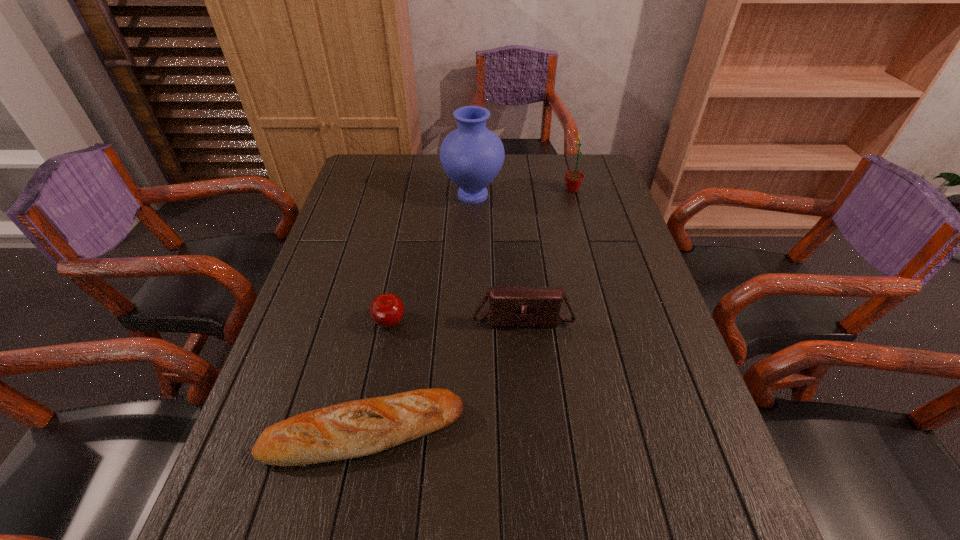
The width and height of the screenshot is (960, 540). In order to click on free space located on the face of the sunflower in this screenshot , I will do `click(469, 190)`.

I want to click on vacant space positioned 0.060m on the front flap of the shoulder bag, so point(526,352).

The image size is (960, 540). Find the location of `free location located 0.210m on the back of the cherry`. free location located 0.210m on the back of the cherry is located at coordinates (402, 255).

Locate an element on the screen. This screenshot has width=960, height=540. vacant region located on the back of the nearest object is located at coordinates (379, 362).

Find the location of a particular element. This screenshot has height=540, width=960. vase that is at the far edge is located at coordinates click(x=472, y=156).

The image size is (960, 540). What are the coordinates of `sunflower positioned at the far edge` in the screenshot? It's located at (573, 179).

Find the location of a particular element. The width and height of the screenshot is (960, 540). object at the left edge is located at coordinates (352, 429).

Identify the location of object located in the right edge section of the desktop. (573, 179).

Image resolution: width=960 pixels, height=540 pixels. Find the location of `object at the far right corner`. object at the far right corner is located at coordinates (573, 179).

This screenshot has width=960, height=540. What are the coordinates of `vacant region at the far edge of the desktop` in the screenshot? It's located at (420, 181).